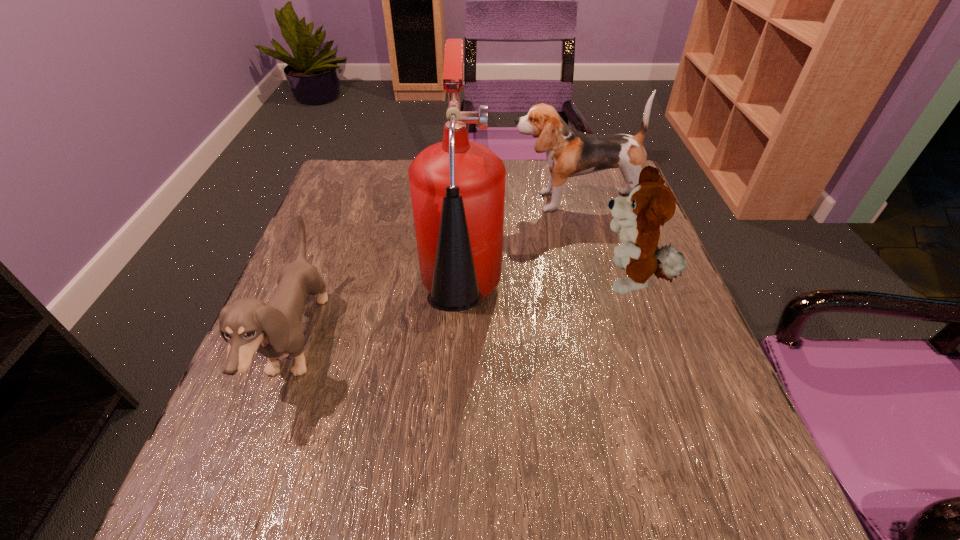
At what (x,y) coordinates should I click in order to perform the action: click on blank space located 0.220m at the face of the second tallest object. Please return your answer as a coordinate pair (x, y). Looking at the image, I should click on (425, 201).

The width and height of the screenshot is (960, 540). What are the coordinates of `vacant space located 0.080m on the face of the second shortest object` in the screenshot? It's located at (554, 282).

Locate an element on the screen. This screenshot has width=960, height=540. free region located on the face of the second shortest object is located at coordinates tap(564, 282).

The width and height of the screenshot is (960, 540). I want to click on vacant space located on the face of the second shortest object, so click(x=520, y=282).

Where is `vacant space located 0.220m at the face of the shortest object`? The height and width of the screenshot is (540, 960). vacant space located 0.220m at the face of the shortest object is located at coordinates (441, 342).

Locate an element on the screen. object that is at the far edge is located at coordinates (570, 153).

At what (x,y) coordinates should I click in order to perform the action: click on object that is at the left edge. Please return your answer as a coordinate pair (x, y). The height and width of the screenshot is (540, 960). Looking at the image, I should click on (249, 325).

Where is `object at the far right corner`? The height and width of the screenshot is (540, 960). object at the far right corner is located at coordinates (570, 153).

This screenshot has height=540, width=960. I want to click on free region at the far edge of the desktop, so pos(529,164).

You are a GUI agent. You are given a task and a screenshot of the screen. Output one action in this format:
    pyautogui.click(x=<x>, y=<y>)
    Task: Click on the vacant area at the left edge
    
    Given the screenshot: What is the action you would take?
    pyautogui.click(x=323, y=323)